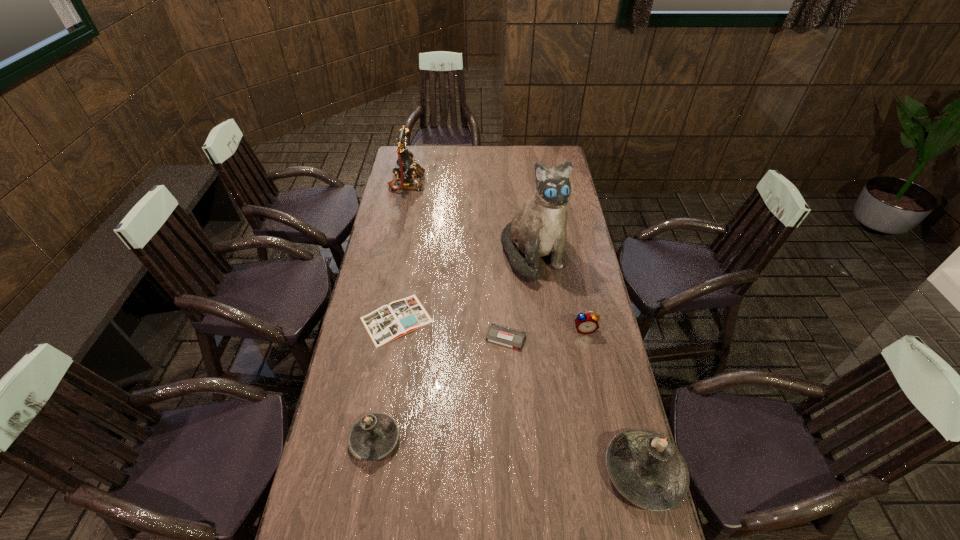
Find the location of `telephone present at the left edge`. telephone present at the left edge is located at coordinates (x=405, y=168).

Image resolution: width=960 pixels, height=540 pixels. I want to click on book that is at the left edge, so click(400, 317).

Identify the location of candle located at the right edge. This screenshot has height=540, width=960. (646, 468).

Find the location of a particular element. This screenshot has height=540, width=960. cat located at the right edge is located at coordinates (538, 229).

Find the location of a particular element. This screenshot has height=540, width=960. alarm clock positioned at the right edge is located at coordinates (586, 323).

Where is `object located at the near right corner`? This screenshot has height=540, width=960. object located at the near right corner is located at coordinates (646, 468).

In the image, there is a desktop. Where is `free space at the far edge`? free space at the far edge is located at coordinates (438, 146).

Find the location of a particular element. This screenshot has height=540, width=960. free space at the left edge of the desktop is located at coordinates (375, 292).

What are the coordinates of `free region at the right edge of the desktop` in the screenshot? It's located at (622, 409).

The image size is (960, 540). In order to click on free spot at the far left corner of the desktop in this screenshot , I will do `click(418, 151)`.